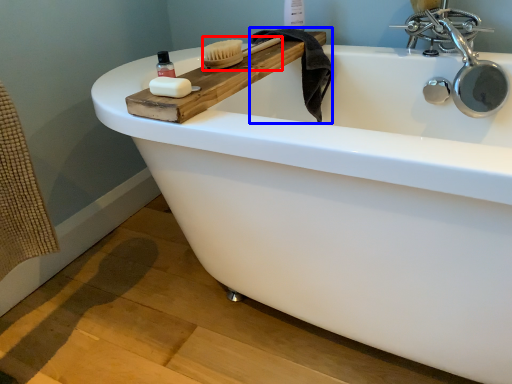
Question: Which of the following is the closest to the observer, brush (highlighted by a red box) or bath towel (highlighted by a blue box)?

Choices:
 (A) brush
 (B) bath towel

Answer: (A)